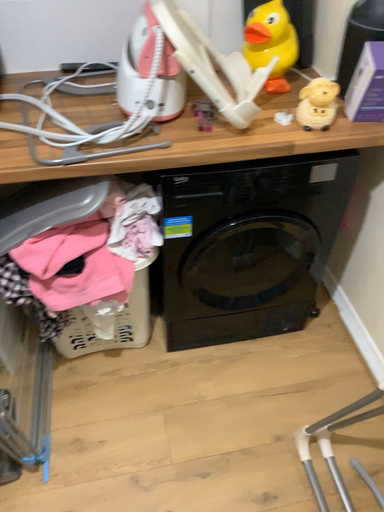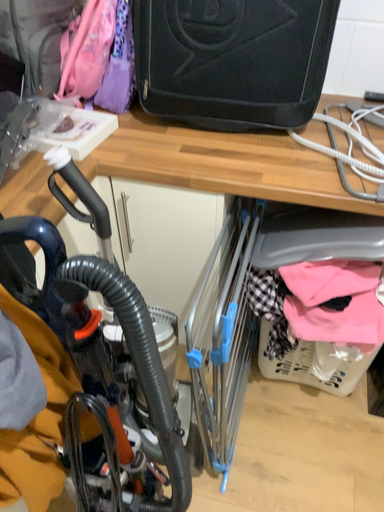
Question: Which way did the camera rotate in the video?

Choices:
 (A) rotated right
 (B) rotated left

Answer: (B)